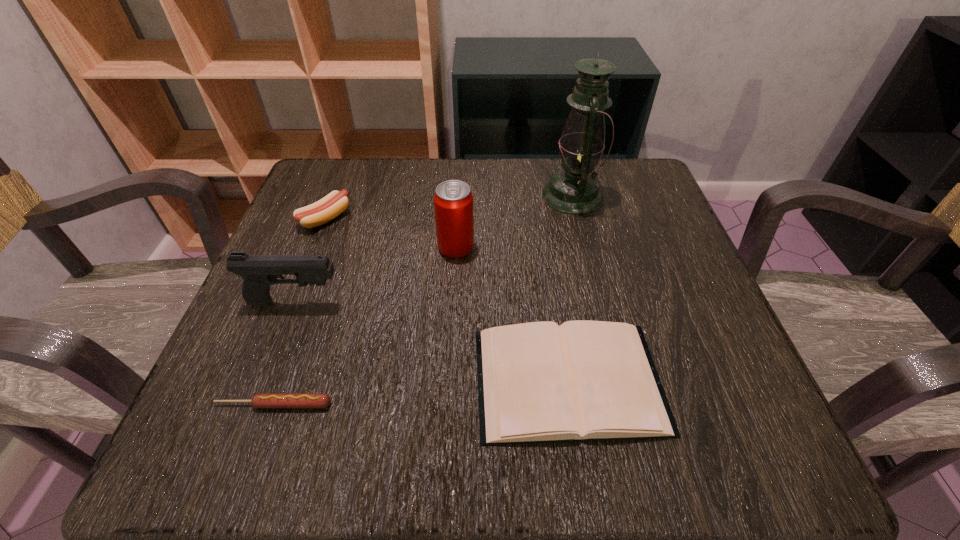
You are a GUI agent. You are given a task and a screenshot of the screen. Output one action in this format:
    pyautogui.click(x=<x>, y=<y>)
    Task: Click on the vacant space at the right edge
    This screenshot has width=960, height=540.
    Given the screenshot: What is the action you would take?
    pyautogui.click(x=660, y=341)

The width and height of the screenshot is (960, 540). Find the location of `free space at the far left corner of the desktop`. free space at the far left corner of the desktop is located at coordinates (322, 195).

Find the location of `free region at the far right corner of the desktop`. free region at the far right corner of the desktop is located at coordinates (636, 158).

Where is `free space that is in between the shorter sausage and the third farthest object`? free space that is in between the shorter sausage and the third farthest object is located at coordinates (365, 326).

The image size is (960, 540). Find the location of `free space between the shorter sausage and the tallest object`. free space between the shorter sausage and the tallest object is located at coordinates (423, 300).

Locate an element on the screen. The image size is (960, 540). free space that is in between the oil lamp and the shortest object is located at coordinates (423, 300).

The height and width of the screenshot is (540, 960). I want to click on free area in between the shortest object and the can, so click(x=365, y=326).

Identify the location of unoccupied position between the tallest object and the third nearest object. The image size is (960, 540). (434, 249).

Locate an element on the screen. Image resolution: width=960 pixels, height=540 pixels. free point between the tallest object and the nearer sausage is located at coordinates (423, 300).

This screenshot has width=960, height=540. What are the coordinates of `free space between the tallest object and the nearer sausage` in the screenshot? It's located at (423, 300).